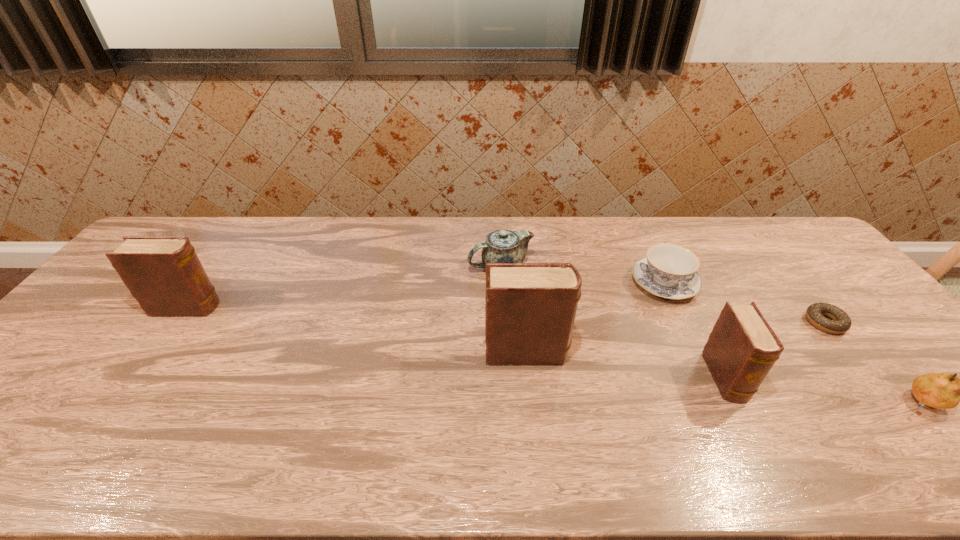
Find the location of a particular element. This screenshot has width=960, height=540. the leftmost diary is located at coordinates pyautogui.click(x=164, y=274).

In order to click on the sixth shortest object in this screenshot , I will do `click(164, 274)`.

At what (x,y) coordinates should I click in order to perform the action: click on the second diary from right to left. Please return your answer as a coordinate pair (x, y). This screenshot has height=540, width=960. Looking at the image, I should click on (530, 309).

Locate an element on the screen. This screenshot has width=960, height=540. the fifth shortest object is located at coordinates (742, 348).

Image resolution: width=960 pixels, height=540 pixels. What are the coordinates of `the rightmost diary` in the screenshot? It's located at (742, 348).

At what (x,y) coordinates should I click in order to perform the action: click on the left chinaware. Please return your answer as a coordinate pair (x, y). The width and height of the screenshot is (960, 540). Looking at the image, I should click on (502, 246).

The image size is (960, 540). I want to click on the taller chinaware, so click(x=502, y=246).

Where is `the shortest object`? the shortest object is located at coordinates (841, 322).

At what (x,y) coordinates should I click in order to perform the action: click on the shorter chinaware. Please return your answer as a coordinate pair (x, y). Looking at the image, I should click on (668, 270).

This screenshot has height=540, width=960. What are the coordinates of `pear` in the screenshot? It's located at (938, 390).